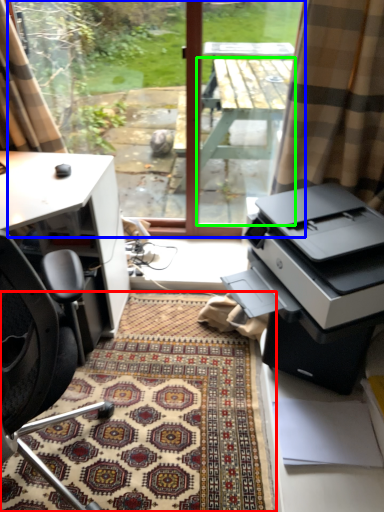
Question: Based on their relative distances, which object is farther from doormat (highlighted by a red box)? Choose from window screen (highlighted by a blue box) and table (highlighted by a green box).

Choices:
 (A) window screen
 (B) table

Answer: (B)